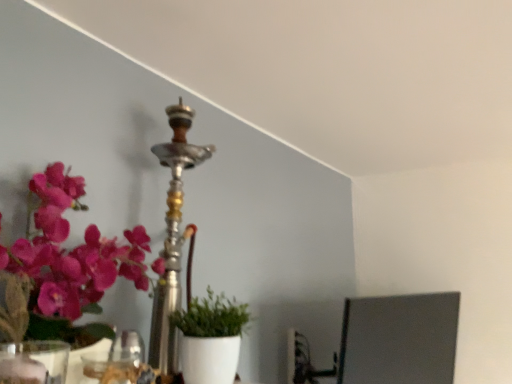
Question: In terms of size, does transparent glass vase at lower left appear bigger or smaller than metallic pink flowers at left?

Choices:
 (A) big
 (B) small

Answer: (B)

Question: Relative to metallic pink flowers at left, is transparent glass vase at lower left in front or behind?

Choices:
 (A) behind
 (B) front

Answer: (B)

Question: Which object is the farthest from the green matte plant at center?

Choices:
 (A) silver metallic hookah at center
 (B) metallic pink flowers at left
 (C) transparent glass vase at lower left

Answer: (C)

Question: Considering the real-world distances, which object is farthest from the transparent glass vase at lower left?

Choices:
 (A) metallic pink flowers at left
 (B) silver metallic hookah at center
 (C) green matte plant at center

Answer: (B)